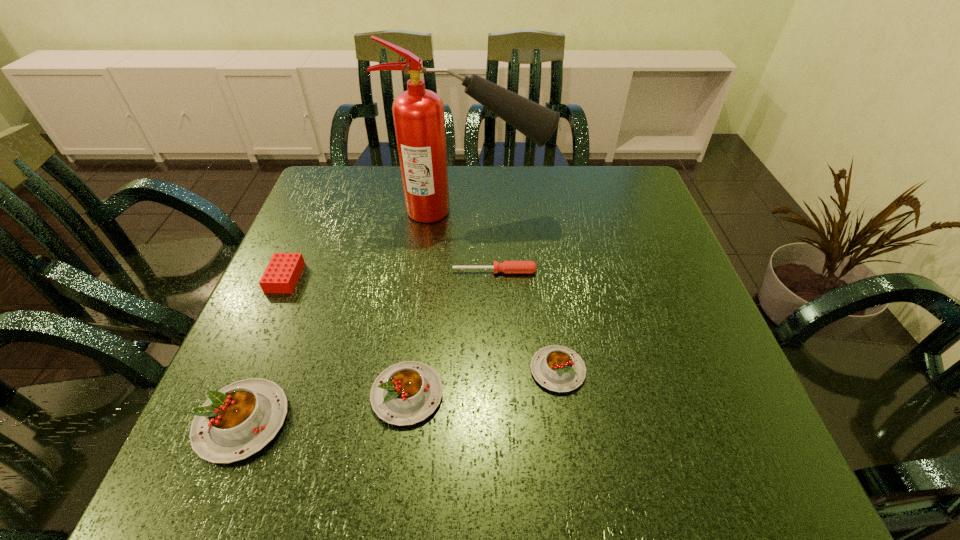
This screenshot has height=540, width=960. Identify the location of vacant point that satisfies the following two spatial constraints: 1. on the back side of the fourth shortest object; 2. on the left side of the rightmost pudding. (411, 370).

At what (x,y) coordinates should I click in order to perform the action: click on vacant space that satisfies the following two spatial constraints: 1. at the nozzle of the tallest object; 2. on the back side of the shortest object. Please return your answer as a coordinate pair (x, y). Looking at the image, I should click on (468, 272).

At what (x,y) coordinates should I click in order to perform the action: click on vacant space that satisfies the following two spatial constraints: 1. on the front side of the second tallest object; 2. on the right side of the Lego. Please return your answer as a coordinate pair (x, y). Looking at the image, I should click on (222, 421).